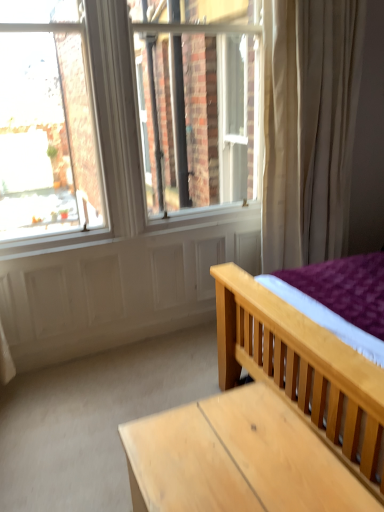
Find the location of `empty space that is ontop of light brown wooden table at lower right`. empty space that is ontop of light brown wooden table at lower right is located at coordinates (238, 456).